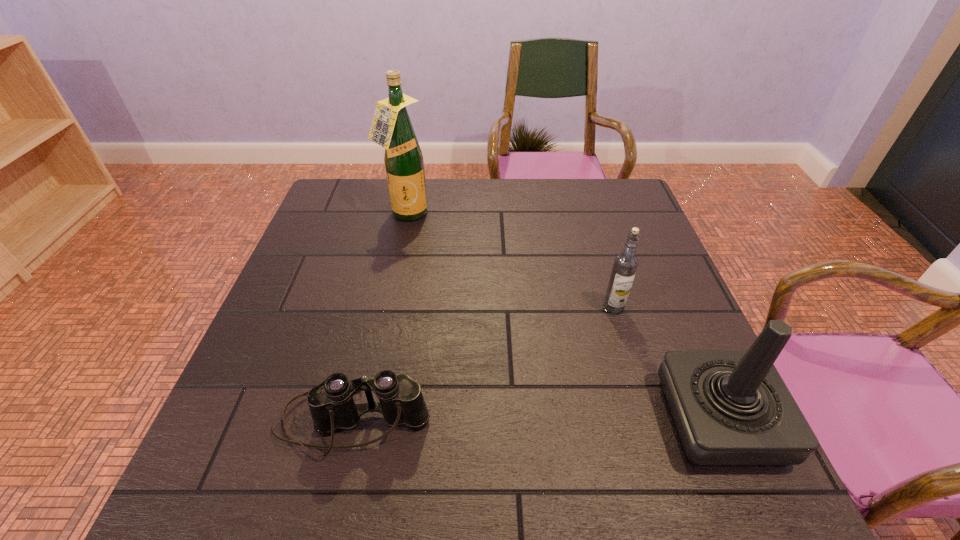
The image size is (960, 540). I want to click on free region that satisfies the following two spatial constraints: 1. on the front side of the joystick; 2. on the front-facing side of the tallest object, so click(362, 420).